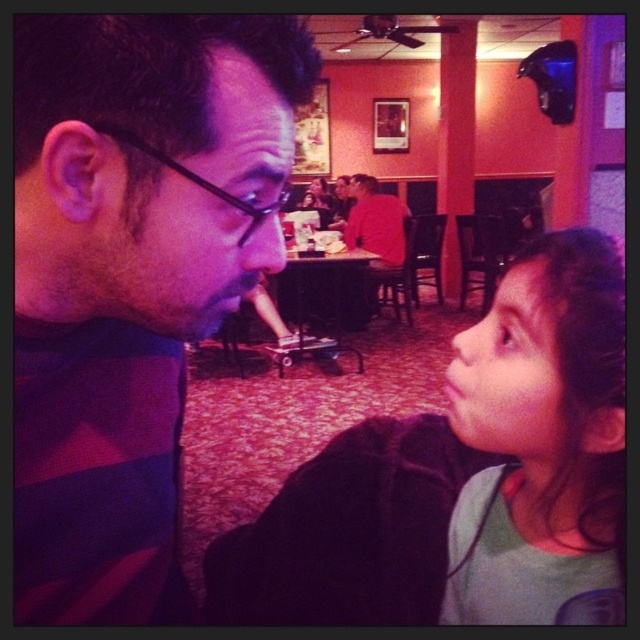
Does matte black jacket at lower right appear on the left side of light green fabric shirt at right?

Yes, matte black jacket at lower right is to the left of light green fabric shirt at right.

Can you confirm if matte black jacket at lower right is bigger than light green fabric shirt at right?

Indeed, matte black jacket at lower right has a larger size compared to light green fabric shirt at right.

This screenshot has height=640, width=640. I want to click on matte black jacket at lower right, so click(x=465, y=477).

Can you confirm if matte black jacket at lower right is positioned below black plastic glasses at left?

Yes, matte black jacket at lower right is below black plastic glasses at left.

Can you confirm if matte black jacket at lower right is wider than black plastic glasses at left?

Yes, matte black jacket at lower right is wider than black plastic glasses at left.

Who is more forward, (412, 561) or (196, 180)?

Point (196, 180) is more forward.

Identify the location of matte black jacket at lower right. Image resolution: width=640 pixels, height=640 pixels. (465, 477).

Is point (403, 208) closer to camera compared to point (170, 156)?

No, it is behind (170, 156).

Which of these two, matte red shirt at center or black plastic glasses at left, stands taller?

With more height is matte red shirt at center.

Is point (353, 240) more distant than point (141, 141)?

Yes.

In order to click on matte red shirt at center in this screenshot , I will do `click(374, 221)`.